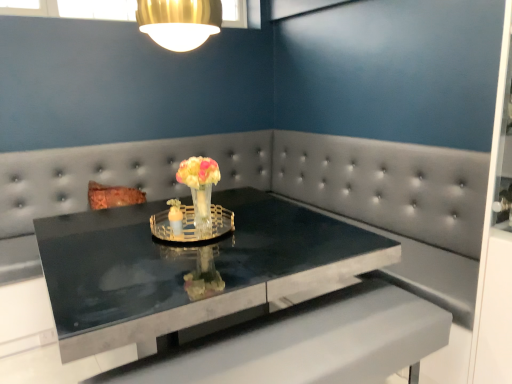
Question: Does clear glass candle holder at center, acting as the second candle holder starting from the left, appear on the left side of translucent glass vase at center?

Choices:
 (A) yes
 (B) no

Answer: (A)

Question: Considering the relative positions of clear glass candle holder at center, acting as the second candle holder starting from the left, and translucent glass vase at center in the image provided, is clear glass candle holder at center, acting as the second candle holder starting from the left, to the right of translucent glass vase at center from the viewer's perspective?

Choices:
 (A) yes
 (B) no

Answer: (B)

Question: Is clear glass candle holder at center, placed as the 1th candle holder when sorted from right to left, surrounding translucent glass vase at center?

Choices:
 (A) no
 (B) yes

Answer: (A)

Question: Is clear glass candle holder at center, acting as the second candle holder starting from the left, bigger than translucent glass vase at center?

Choices:
 (A) no
 (B) yes

Answer: (A)

Question: From a real-world perspective, is clear glass candle holder at center, placed as the 1th candle holder when sorted from right to left, located beneath translucent glass vase at center?

Choices:
 (A) yes
 (B) no

Answer: (A)

Question: Considering the positions of translucent glass candle holder at center, the second candle holder when ordered from right to left, and black marble table at center in the image, is translucent glass candle holder at center, the second candle holder when ordered from right to left, wider or thinner than black marble table at center?

Choices:
 (A) thin
 (B) wide

Answer: (A)

Question: From the image's perspective, relative to black marble table at center, is translucent glass candle holder at center, which is the 1th candle holder from left to right, above or below?

Choices:
 (A) above
 (B) below

Answer: (A)

Question: Considering the positions of point (175, 228) and point (330, 254), is point (175, 228) closer or farther from the camera than point (330, 254)?

Choices:
 (A) farther
 (B) closer

Answer: (A)

Question: Is translucent glass candle holder at center, the second candle holder when ordered from right to left, in front of or behind black marble table at center in the image?

Choices:
 (A) front
 (B) behind

Answer: (B)

Question: From the image's perspective, relative to translucent glass candle holder at center, the second candle holder when ordered from right to left, is black marble table at center above or below?

Choices:
 (A) above
 (B) below

Answer: (B)

Question: Is black marble table at center inside or outside of translucent glass candle holder at center, the second candle holder when ordered from right to left?

Choices:
 (A) outside
 (B) inside

Answer: (A)

Question: Is black marble table at center bigger or smaller than translucent glass candle holder at center, the second candle holder when ordered from right to left?

Choices:
 (A) small
 (B) big

Answer: (B)

Question: From a real-world perspective, relative to translucent glass candle holder at center, which is the 1th candle holder from left to right, is black marble table at center vertically above or below?

Choices:
 (A) above
 (B) below

Answer: (B)

Question: Does point (263, 215) appear closer or farther from the camera than point (187, 236)?

Choices:
 (A) closer
 (B) farther

Answer: (B)

Question: Is black marble table at center situated inside clear glass candle holder at center, placed as the 1th candle holder when sorted from right to left, or outside?

Choices:
 (A) inside
 (B) outside

Answer: (B)